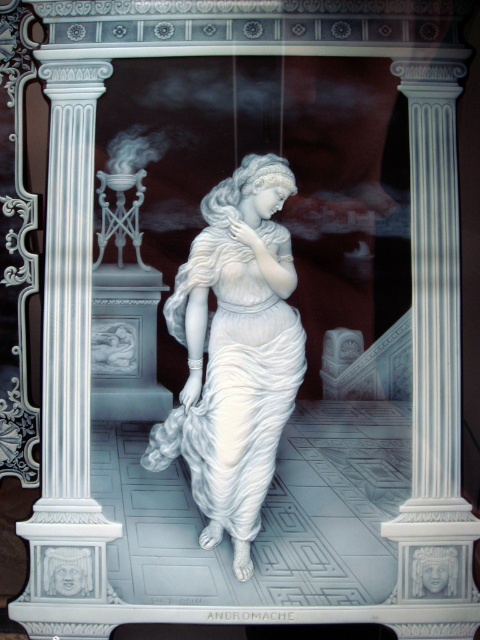
Can you confirm if white marble column at left is positioned below white glossy dress at center?

Incorrect, white marble column at left is not positioned below white glossy dress at center.

Is point (73, 68) positioned behind point (226, 396)?

That is True.

Who is more forward, (82, 252) or (238, 380)?

Point (238, 380) is in front.

You are a GUI agent. You are given a task and a screenshot of the screen. Output one action in this format:
    pyautogui.click(x=<x>, y=<y>)
    Task: Click on the white marble column at left
    The width and height of the screenshot is (480, 640).
    Given the screenshot: What is the action you would take?
    pyautogui.click(x=69, y=349)